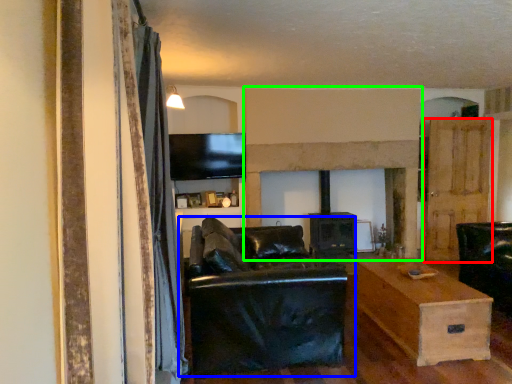
Question: Estimate the real-world distances between objects in this image. Which object is closer to door (highlighted by a red box), studio couch (highlighted by a blue box) or fireplace (highlighted by a green box)?

Choices:
 (A) studio couch
 (B) fireplace

Answer: (B)